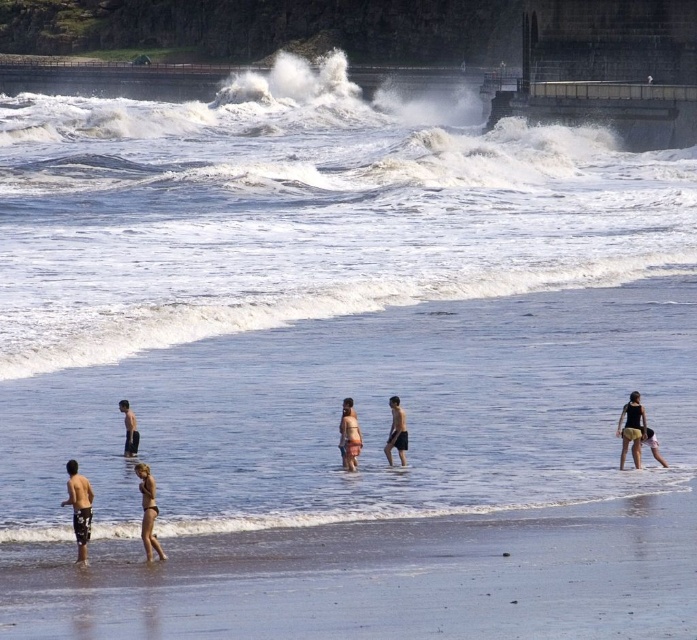
Question: Is black matte shorts at center in front of skinny man at lower left?

Choices:
 (A) yes
 (B) no

Answer: (A)

Question: Which of the following is the closest to the observer?

Choices:
 (A) (659, 460)
 (B) (625, 630)

Answer: (B)

Question: Can you confirm if tan skin human at center is bigger than black matte shorts at center?

Choices:
 (A) no
 (B) yes

Answer: (A)

Question: Which point is farther to the camera?

Choices:
 (A) tan skin human at lower right
 (B) smooth sand beach at lower center

Answer: (A)

Question: Can you confirm if matte black bikini at lower center is bigger than tan skin human at lower right?

Choices:
 (A) yes
 (B) no

Answer: (A)

Question: Which of these objects is positioned farthest from the tan skin human at lower right?

Choices:
 (A) skinny man at lower left
 (B) smooth sand beach at lower center
 (C) matte black bikini at lower center
 (D) black matte shorts at center

Answer: (C)